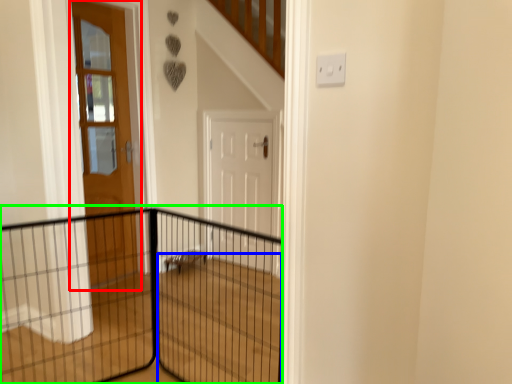
Question: Which is farther away from door (highlighted by a red box)? stairwell (highlighted by a blue box) or fence (highlighted by a green box)?

Choices:
 (A) stairwell
 (B) fence

Answer: (A)